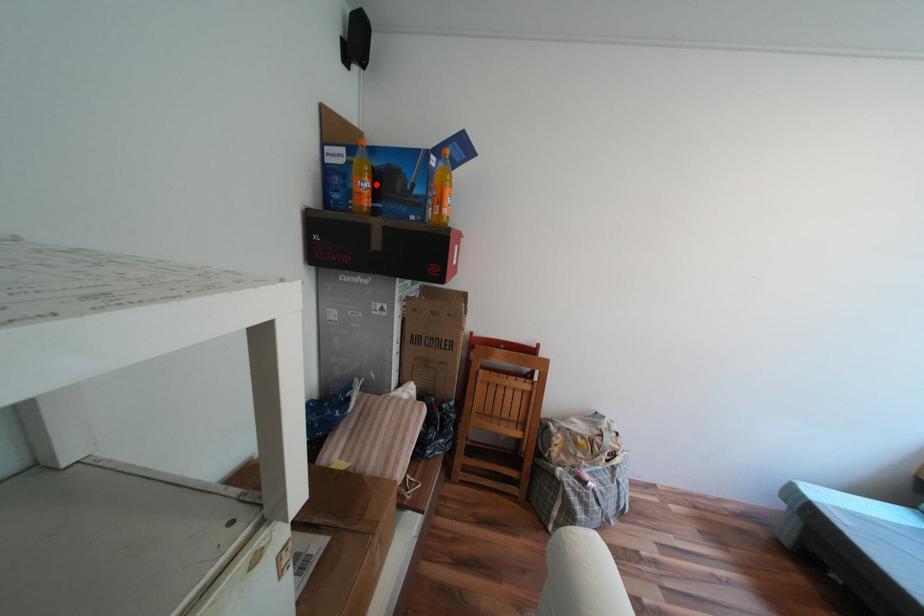
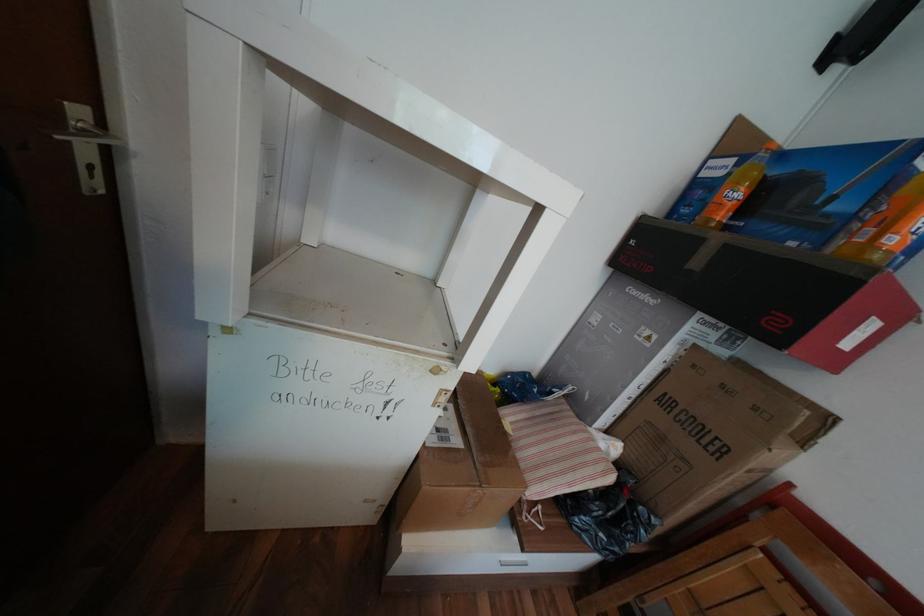
Find the pixel in the second image that matches the highlighted location in the first image.

(748, 195)